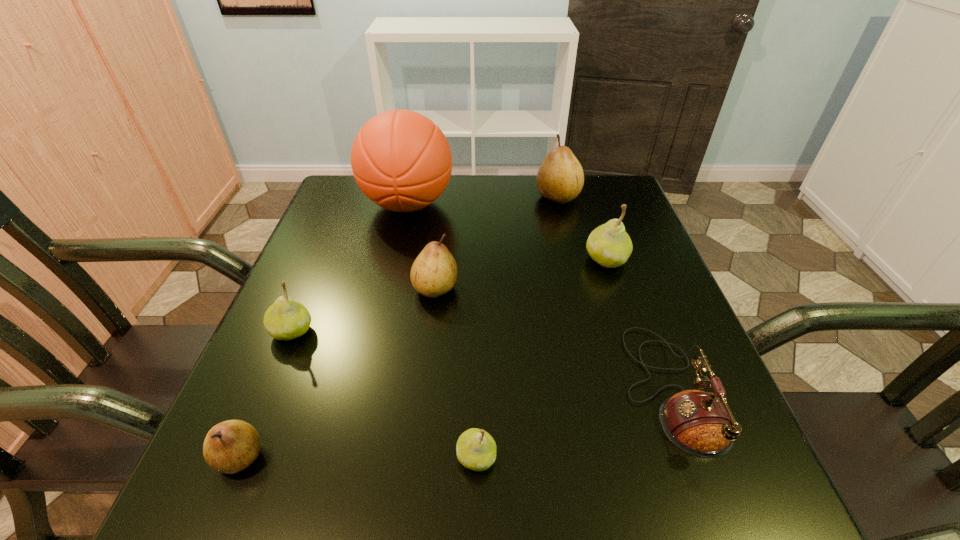
This screenshot has height=540, width=960. I want to click on vacant region located on the rotary dial of the telephone, so click(402, 390).

Where is `vacant space located on the rotary dial of the telephone`? vacant space located on the rotary dial of the telephone is located at coordinates (391, 390).

The width and height of the screenshot is (960, 540). Identify the location of free space located on the rotary dial of the telephone. (502, 390).

Find the location of a particular element. vacant region located 0.390m on the back of the smallest brown pear is located at coordinates (318, 270).

Locate an element on the screen. The image size is (960, 540). free point located on the right of the second green pear from left to right is located at coordinates (589, 457).

Where is `basketball at the far edge`? The image size is (960, 540). basketball at the far edge is located at coordinates (402, 161).

The height and width of the screenshot is (540, 960). I want to click on pear located at the far edge, so click(560, 178).

Locate an element on the screen. This screenshot has width=960, height=540. telephone that is at the near edge is located at coordinates (700, 423).

Locate an element on the screen. This screenshot has height=540, width=960. basketball situated at the left edge is located at coordinates (402, 161).

You are a GUI agent. You are given a task and a screenshot of the screen. Output one action in this format:
    pyautogui.click(x=<x>, y=<y>)
    Task: Click on the telephone that is at the right edge
    
    Given the screenshot: What is the action you would take?
    pyautogui.click(x=700, y=423)